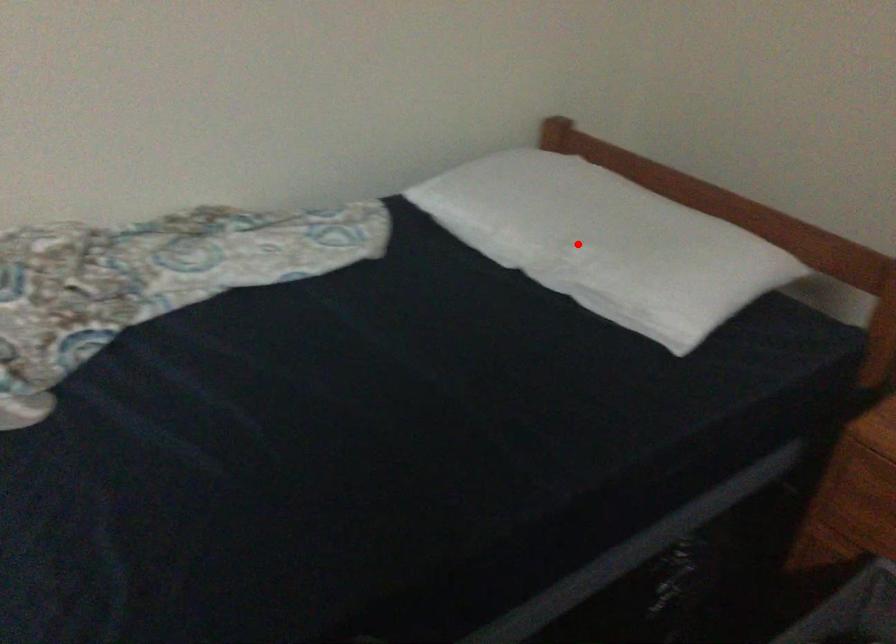
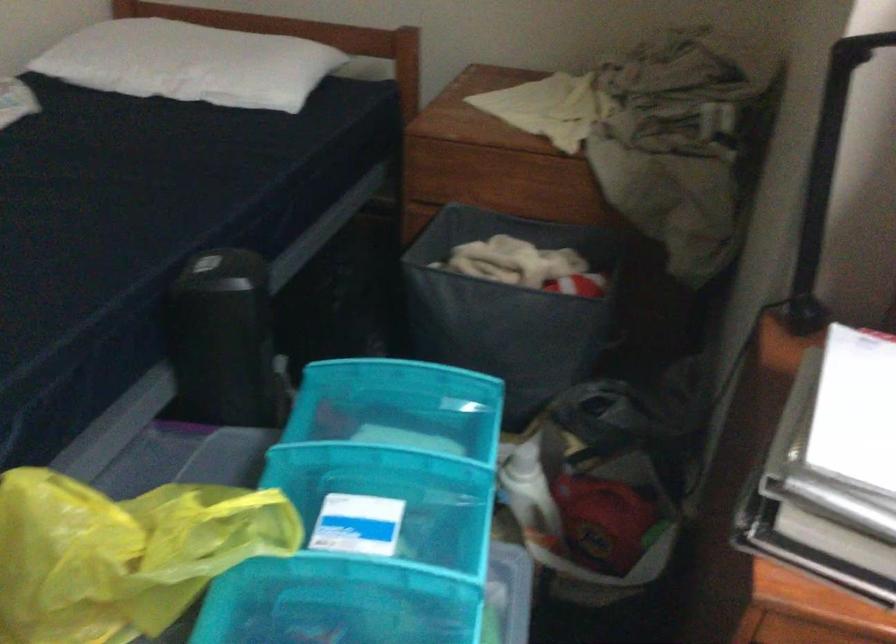
The point at the highlighted location is marked in the first image. Where is the corresponding point in the second image?

(191, 62)